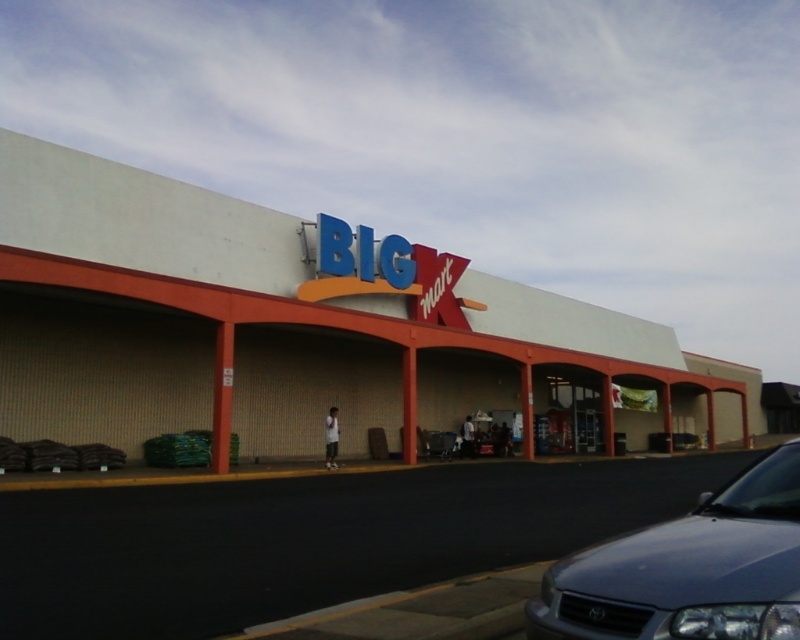
Can you confirm if white concrete mall at center is thinner than satin silver sedan at lower right?

In fact, white concrete mall at center might be wider than satin silver sedan at lower right.

In order to click on white concrete mall at center in this screenshot , I will do `click(297, 330)`.